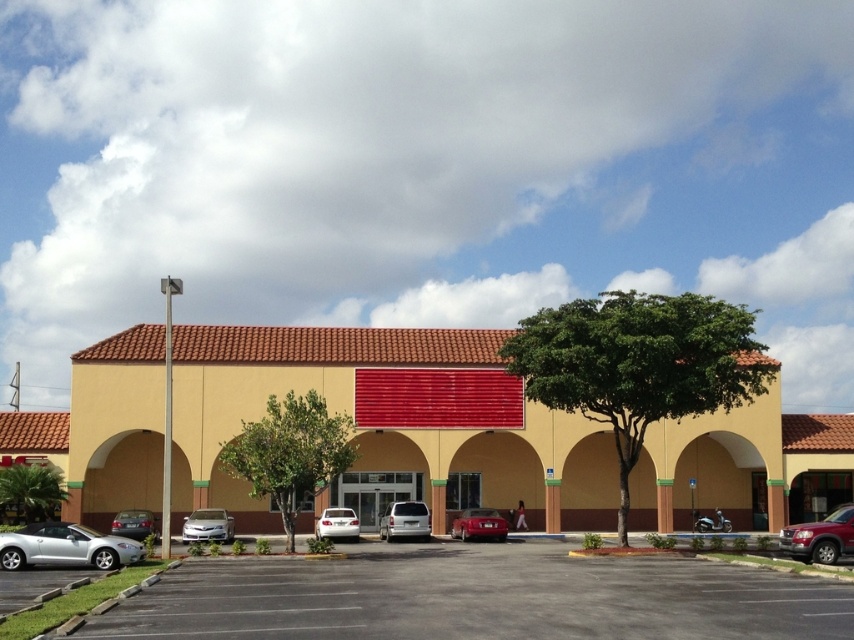
You are standing in front of the commercial building and want to take a photo of the two points marked on the image. Which point, point (387, 520) or point (132, 520), will appear closer to the bottom of the photo?

Point (132, 520) will appear closer to the bottom of the photo because it is closer to the camera than point (387, 520).

You are standing in the parking lot and want to enter the yellow stucco building at center. Which direction should you walk relative to the silver metallic sedan at lower left?

You should walk towards the right side relative to the silver metallic sedan at lower left to reach the yellow stucco building at center.